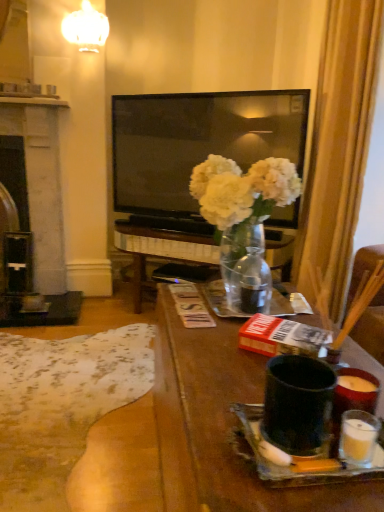
Question: Is matte black mug at center further to camera compared to silky gold curtain at right?

Choices:
 (A) no
 (B) yes

Answer: (A)

Question: Considering the relative sizes of matte black mug at center and silky gold curtain at right in the image provided, is matte black mug at center thinner than silky gold curtain at right?

Choices:
 (A) no
 (B) yes

Answer: (B)

Question: From the image's perspective, is matte black mug at center located beneath silky gold curtain at right?

Choices:
 (A) yes
 (B) no

Answer: (A)

Question: Can you confirm if matte black mug at center is bigger than silky gold curtain at right?

Choices:
 (A) no
 (B) yes

Answer: (A)

Question: Does matte black mug at center have a greater width compared to silky gold curtain at right?

Choices:
 (A) no
 (B) yes

Answer: (A)

Question: Considering the positions of white glossy lampshade at upper center and silky gold curtain at right in the image, is white glossy lampshade at upper center wider or thinner than silky gold curtain at right?

Choices:
 (A) thin
 (B) wide

Answer: (A)

Question: Is white glossy lampshade at upper center in front of or behind silky gold curtain at right in the image?

Choices:
 (A) behind
 (B) front

Answer: (A)

Question: Would you say white glossy lampshade at upper center is to the left or to the right of silky gold curtain at right in the picture?

Choices:
 (A) left
 (B) right

Answer: (A)

Question: From the image's perspective, is white glossy lampshade at upper center positioned above or below silky gold curtain at right?

Choices:
 (A) below
 (B) above

Answer: (B)

Question: Based on their sizes in the image, would you say matte black mug at center is bigger or smaller than silky gold curtain at right?

Choices:
 (A) small
 (B) big

Answer: (A)

Question: From a real-world perspective, is matte black mug at center above or below silky gold curtain at right?

Choices:
 (A) below
 (B) above

Answer: (A)

Question: Is matte black mug at center spatially inside silky gold curtain at right, or outside of it?

Choices:
 (A) inside
 (B) outside

Answer: (B)

Question: Does point (370, 366) appear closer or farther from the camera than point (362, 71)?

Choices:
 (A) closer
 (B) farther

Answer: (A)

Question: Considering the positions of black stone fireplace at left and matte black mug at center in the image, is black stone fireplace at left taller or shorter than matte black mug at center?

Choices:
 (A) short
 (B) tall

Answer: (B)

Question: From the image's perspective, is black stone fireplace at left located above or below matte black mug at center?

Choices:
 (A) above
 (B) below

Answer: (A)